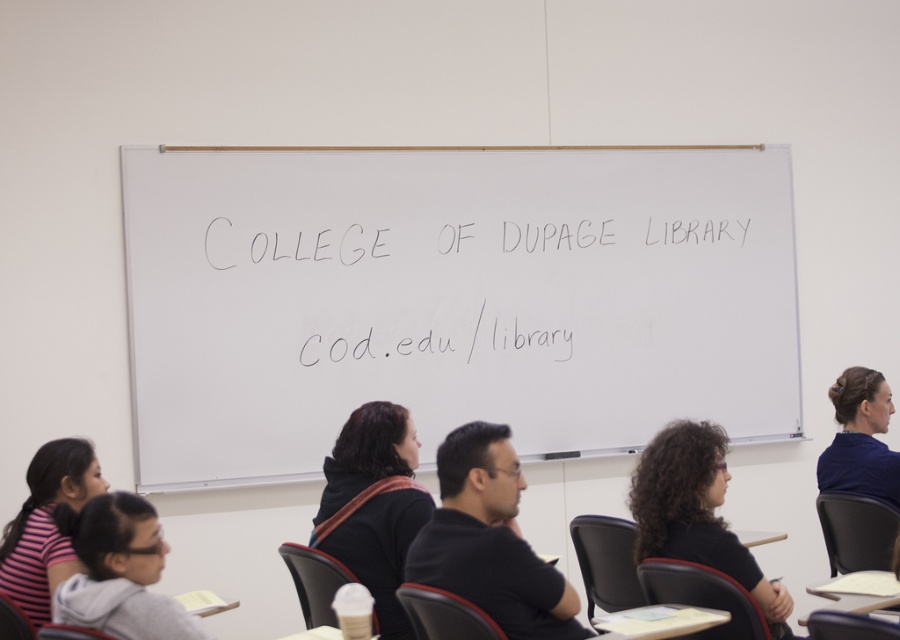
Does black matte shirt at center have a lesser width compared to black matte jacket at center?

No.

Who is shorter, black matte shirt at center or black matte jacket at center?

black matte shirt at center

Which is in front, point (455, 554) or point (338, 528)?

Point (455, 554) is in front.

I want to click on black matte shirt at center, so click(489, 540).

Is point (469, 424) closer to camera compared to point (153, 616)?

No.

Can you confirm if black matte shirt at center is positioned above gray hoodie at lower left?

Incorrect, black matte shirt at center is not positioned above gray hoodie at lower left.

Who is more distant from viewer, (527, 564) or (158, 630)?

Point (527, 564)

The width and height of the screenshot is (900, 640). Find the location of `black matte shirt at center`. black matte shirt at center is located at coordinates (489, 540).

Is white chalk writing at center smaller than gray hoodie at lower left?

No, white chalk writing at center is not smaller than gray hoodie at lower left.

Consider the image. Is white chalk writing at center to the right of gray hoodie at lower left from the viewer's perspective?

Yes, white chalk writing at center is to the right of gray hoodie at lower left.

The width and height of the screenshot is (900, 640). What do you see at coordinates (462, 284) in the screenshot? I see `white chalk writing at center` at bounding box center [462, 284].

You are a GUI agent. You are given a task and a screenshot of the screen. Output one action in this format:
    pyautogui.click(x=<x>, y=<y>)
    Task: Click on the white chalk writing at center
    This screenshot has height=640, width=900.
    Given the screenshot: What is the action you would take?
    pyautogui.click(x=462, y=284)